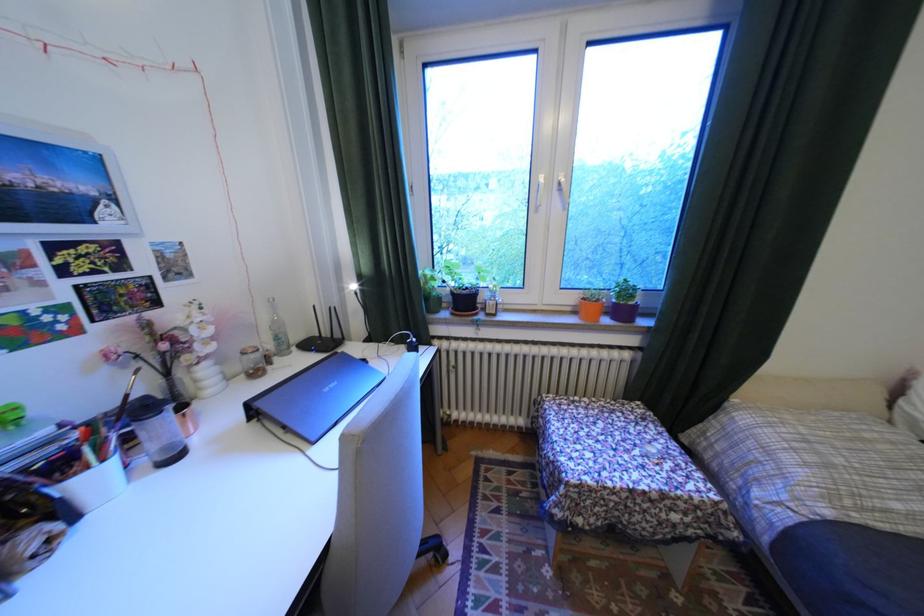
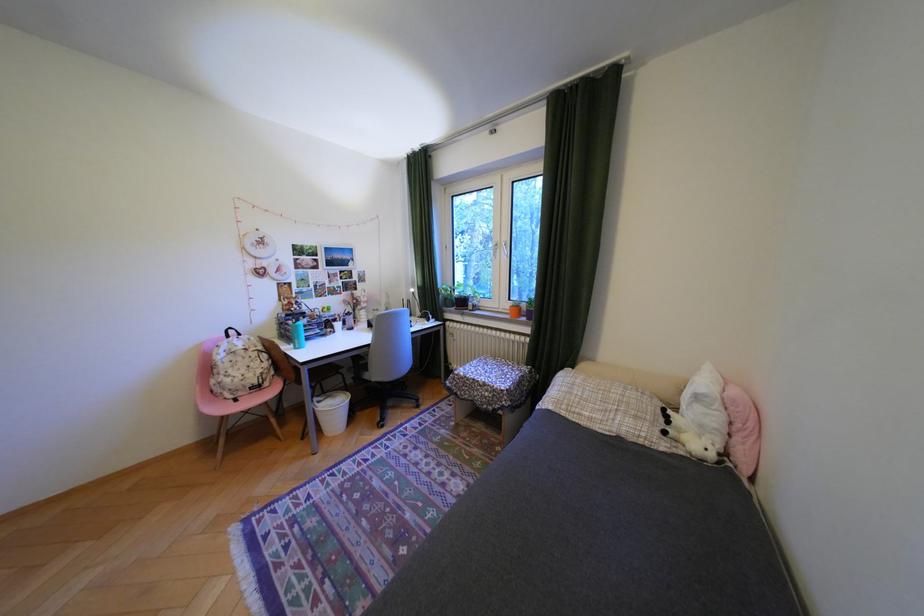
Where in the second image is the point corresponding to the point at 478,302 from the first image?

(475, 302)